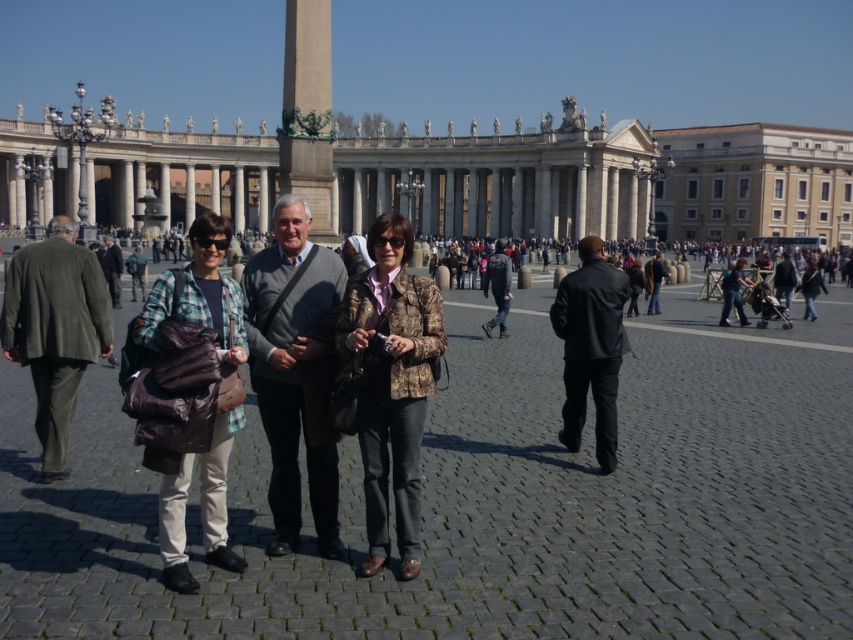
You are a photographer standing at St. Peter Basilica. You want to take a photo of the gray sweater at center and dark green suit at left. Which one should you zoom in more on to capture their full height in the photo?

The gray sweater at center has a greater height compared to the dark green suit at left, so you should zoom in more on the gray sweater at center to capture its full height.

You are a photographer at St. Peter Basilica and want to capture both the denim jacket at center and the denim jacket at lower right in a single shot. Which jacket should you focus on first to ensure both are in frame?

The denim jacket at center is positioned on the left side of denim jacket at lower right, so you should focus on the denim jacket at center first to ensure both are in frame.